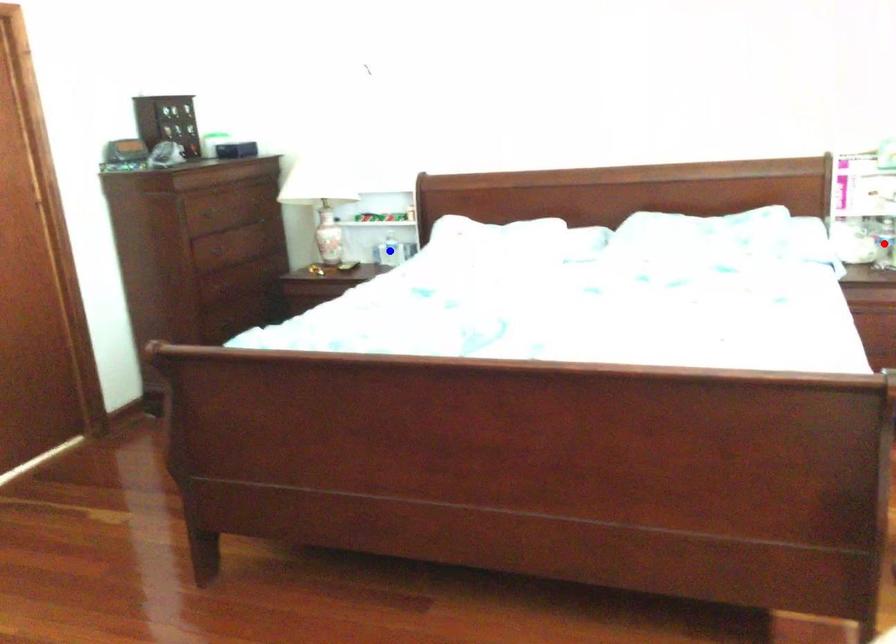
Question: In the image, two points are highlighted. Which point is nearer to the camera? Reply with the corresponding letter.

Choices:
 (A) blue point
 (B) red point

Answer: (B)